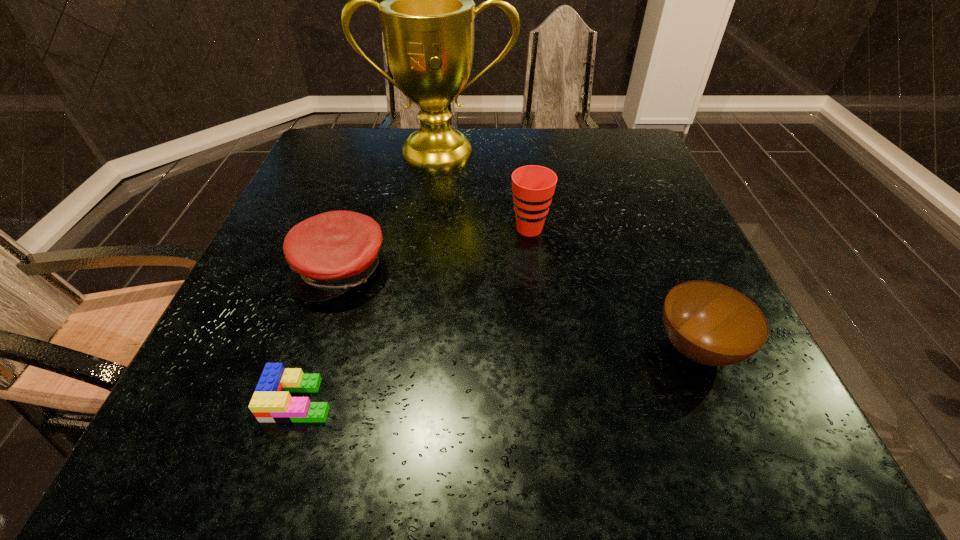
Identify the location of vacant area at the left edge of the desktop. (291, 203).

Image resolution: width=960 pixels, height=540 pixels. I want to click on vacant region at the right edge, so click(774, 388).

Image resolution: width=960 pixels, height=540 pixels. Find the location of `free space at the far left corner of the desktop`. free space at the far left corner of the desktop is located at coordinates (334, 127).

Find the location of `vacant space at the far right corner`. vacant space at the far right corner is located at coordinates (592, 134).

I want to click on free space that is in between the cap and the shortest object, so click(321, 335).

The width and height of the screenshot is (960, 540). I want to click on vacant area between the award and the fourth shortest object, so [485, 190].

Identify the location of free space between the second tallest object and the rightmost object. Image resolution: width=960 pixels, height=540 pixels. (613, 288).

I want to click on unoccupied area between the cap and the fourth shortest object, so click(436, 249).

You are a GUI agent. You are given a task and a screenshot of the screen. Output one action in this format:
    pyautogui.click(x=<x>, y=<y>)
    Task: Click on the unoccupied position between the cap and the fourth shortest object
    This screenshot has width=960, height=540.
    Given the screenshot: What is the action you would take?
    pyautogui.click(x=436, y=249)

Where is `empty location between the cup and the shortest object`? empty location between the cup and the shortest object is located at coordinates (415, 314).